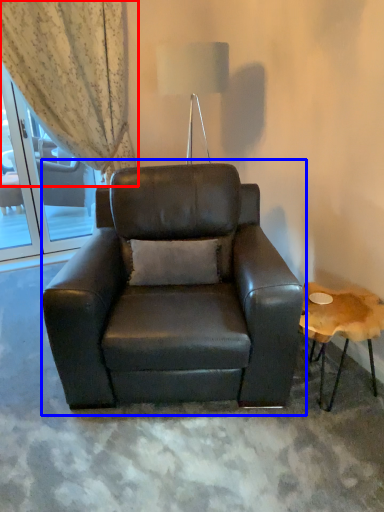
Question: Which object is closer to the camera taking this photo, curtain (highlighted by a red box) or chair (highlighted by a blue box)?

Choices:
 (A) curtain
 (B) chair

Answer: (B)